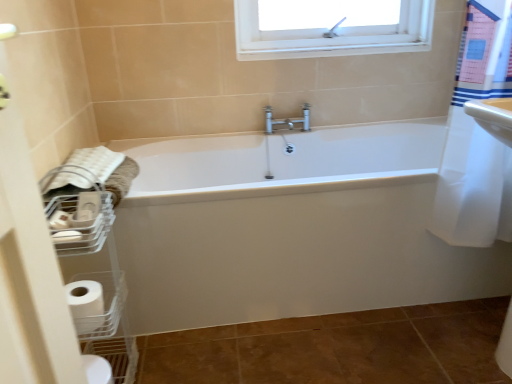
In order to face white soft towel at left, should I rotate leftwards or rightwards?

Turn left by 21.525 degrees to look at white soft towel at left.

The image size is (512, 384). What do you see at coordinates (92, 272) in the screenshot?
I see `white plastic basket at lower left` at bounding box center [92, 272].

In order to face white plastic basket at lower left, should I rotate leftwards or rightwards?

A 21.185 degree turn to the left will do.

Measure the distance between point (168, 222) and camera.

They are 4.58 feet apart.

What is the approximate width of white glossy bathtub at center?

29.41 inches.

Image resolution: width=512 pixels, height=384 pixels. What do you see at coordinates (86, 305) in the screenshot? I see `white matte toilet paper at lower left` at bounding box center [86, 305].

Where is `white soft towel at left`? This screenshot has height=384, width=512. white soft towel at left is located at coordinates click(86, 169).

Measure the distance between brown matte ceramic tile at lower center and white plastic basket at lower left.

brown matte ceramic tile at lower center and white plastic basket at lower left are 22.02 inches apart.

Does point (466, 315) come farther from viewer compared to point (78, 243)?

Yes, point (466, 315) is behind point (78, 243).

Consider the image. From their relative heights in the image, would you say brown matte ceramic tile at lower center is taller or shorter than white plastic basket at lower left?

Considering their sizes, brown matte ceramic tile at lower center has less height than white plastic basket at lower left.

Which is more to the right, brown matte ceramic tile at lower center or white plastic basket at lower left?

From the viewer's perspective, brown matte ceramic tile at lower center appears more on the right side.

Considering the relative sizes of white glossy bathtub at center and white soft towel at left in the image provided, is white glossy bathtub at center bigger than white soft towel at left?

Yes, white glossy bathtub at center is bigger than white soft towel at left.

Which of these two, white glossy bathtub at center or white soft towel at left, is wider?

white glossy bathtub at center is wider.

From a real-world perspective, does white glossy bathtub at center stand above white soft towel at left?

Actually, white glossy bathtub at center is physically below white soft towel at left in the real world.

Does point (400, 205) come in front of point (118, 161)?

Yes, point (400, 205) is closer to viewer.

The image size is (512, 384). What are the coordinates of `balustrade below the white soft towel at left (from the image's perspective)` in the screenshot? It's located at (92, 272).

From a real-world perspective, between white plastic basket at lower left and white soft towel at left, who is vertically lower?

white plastic basket at lower left, from a real-world perspective.

Is white plastic basket at lower left turned away from white soft towel at left?

white plastic basket at lower left is not turned away from white soft towel at left.

Considering the sizes of objects white plastic basket at lower left and white soft towel at left in the image provided, who is taller, white plastic basket at lower left or white soft towel at left?

white plastic basket at lower left.

Is white matte toilet paper at lower left oriented away from white glossy bathtub at center?

white matte toilet paper at lower left does not have its back to white glossy bathtub at center.

Considering the relative positions of white matte toilet paper at lower left and white glossy bathtub at center in the image provided, is white matte toilet paper at lower left to the right of white glossy bathtub at center from the viewer's perspective?

No.

Is there a large distance between white matte toilet paper at lower left and white glossy bathtub at center?

white matte toilet paper at lower left is near white glossy bathtub at center, not far away.

Does white matte toilet paper at lower left contain white glossy bathtub at center?

No, white matte toilet paper at lower left does not contain white glossy bathtub at center.

How different are the orientations of white soft towel at left and brown matte ceramic tile at lower center in degrees?

90 degrees separate the facing orientations of white soft towel at left and brown matte ceramic tile at lower center.

Based on their positions, is white soft towel at left located to the left or right of brown matte ceramic tile at lower center?

Based on their positions, white soft towel at left is located to the left of brown matte ceramic tile at lower center.

Is white soft towel at left wider or thinner than brown matte ceramic tile at lower center?

Clearly, white soft towel at left has less width compared to brown matte ceramic tile at lower center.

From the picture: Is white soft towel at left not near brown matte ceramic tile at lower center?

white soft towel at left is near brown matte ceramic tile at lower center, not far away.

Considering the positions of objects white matte toilet paper at lower left and white plastic basket at lower left in the image provided, who is more to the right, white matte toilet paper at lower left or white plastic basket at lower left?

white matte toilet paper at lower left.

Is white matte toilet paper at lower left not close to white plastic basket at lower left?

No, white matte toilet paper at lower left is in close proximity to white plastic basket at lower left.

Is white matte toilet paper at lower left oriented away from white plastic basket at lower left?

Yes, white matte toilet paper at lower left is positioned with its back facing white plastic basket at lower left.

Can you tell me how much white matte toilet paper at lower left and white plastic basket at lower left differ in facing direction?

0.000295 degrees.

Can we say white matte toilet paper at lower left lies outside brown matte ceramic tile at lower center?

Yes, white matte toilet paper at lower left is located beyond the bounds of brown matte ceramic tile at lower center.

From a real-world perspective, is white matte toilet paper at lower left over brown matte ceramic tile at lower center?

Correct, in the physical world, white matte toilet paper at lower left is higher than brown matte ceramic tile at lower center.

Which of these two, white matte toilet paper at lower left or brown matte ceramic tile at lower center, is bigger?

brown matte ceramic tile at lower center.

At what (x,y) coordinates should I click in order to perform the action: click on ceramic tile on the right of white plastic basket at lower left. Please return your answer as a coordinate pair (x, y). Looking at the image, I should click on (337, 348).

Where is `bathtub located behind the white soft towel at left`? bathtub located behind the white soft towel at left is located at coordinates (292, 228).

From the image, which object appears to be farther from white plastic basket at lower left, white soft towel at left or brown matte ceramic tile at lower center?

Among the two, brown matte ceramic tile at lower center is located further to white plastic basket at lower left.

Considering their positions, is white glossy bathtub at center positioned further to white plastic basket at lower left than brown matte ceramic tile at lower center?

Based on the image, brown matte ceramic tile at lower center appears to be further to white plastic basket at lower left.

Estimate the real-world distances between objects in this image. Which object is further from white matte toilet paper at lower left, brown matte ceramic tile at lower center or white soft towel at left?

brown matte ceramic tile at lower center.

Looking at the image, which one is located closer to white plastic basket at lower left, white matte toilet paper at lower left or white glossy bathtub at center?

white matte toilet paper at lower left is positioned closer to the anchor white plastic basket at lower left.

Considering their positions, is white plastic basket at lower left positioned closer to white soft towel at left than brown matte ceramic tile at lower center?

white plastic basket at lower left is positioned closer to the anchor white soft towel at left.

From the image, which object appears to be farther from white glossy bathtub at center, white matte toilet paper at lower left or brown matte ceramic tile at lower center?

white matte toilet paper at lower left lies further to white glossy bathtub at center than the other object.

Looking at the image, which one is located further to white glossy bathtub at center, white plastic basket at lower left or white soft towel at left?

white soft towel at left lies further to white glossy bathtub at center than the other object.

Based on their spatial positions, is white glossy bathtub at center or white plastic basket at lower left further from white soft towel at left?

white glossy bathtub at center is further to white soft towel at left.

The height and width of the screenshot is (384, 512). What are the coordinates of `bathtub situated between white plastic basket at lower left and brown matte ceramic tile at lower center from left to right` in the screenshot? It's located at (292, 228).

The image size is (512, 384). In order to click on toilet paper located between white plastic basket at lower left and brown matte ceramic tile at lower center in the left-right direction in this screenshot , I will do `click(86, 305)`.

You are a GUI agent. You are given a task and a screenshot of the screen. Output one action in this format:
    pyautogui.click(x=<x>, y=<y>)
    Task: Click on the toilet paper between white soft towel at left and white glossy bathtub at center
    
    Given the screenshot: What is the action you would take?
    pyautogui.click(x=86, y=305)

I want to click on bathtub located between white soft towel at left and brown matte ceramic tile at lower center in the left-right direction, so click(x=292, y=228).